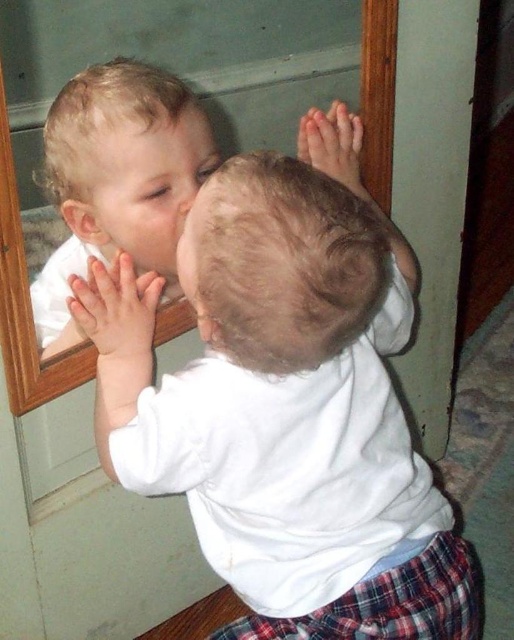
Question: Which point is farther from the camera taking this photo?

Choices:
 (A) (89, 216)
 (B) (197, 184)
 (C) (260, 452)
 (D) (4, 353)

Answer: (B)

Question: In this image, where is wooden mirror at upper center located relative to smooth skin face at upper left?

Choices:
 (A) left
 (B) right

Answer: (A)

Question: Does white soft baby at center have a larger size compared to smooth white shirt at center?

Choices:
 (A) no
 (B) yes

Answer: (B)

Question: Which point appears farthest from the camera in this image?

Choices:
 (A) (343, 630)
 (B) (192, 193)
 (C) (23, 262)
 (D) (150, 180)

Answer: (B)

Question: Which point is closer to the camera?

Choices:
 (A) (117, 147)
 (B) (171, 260)
 (C) (11, 250)
 (D) (243, 192)

Answer: (D)

Question: Is smooth white shirt at center further to the viewer compared to smooth skin face at upper left?

Choices:
 (A) yes
 (B) no

Answer: (B)